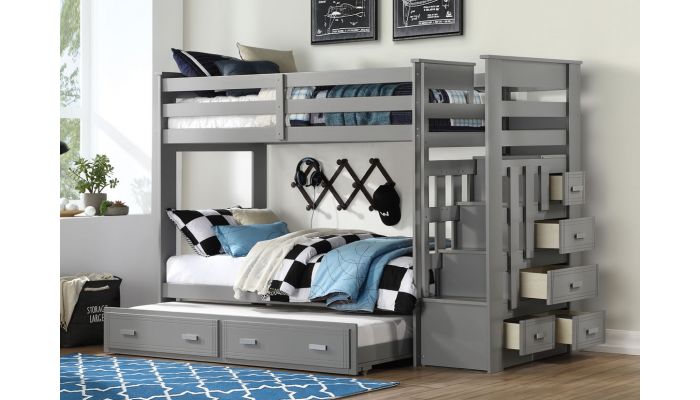
This screenshot has height=400, width=700. In order to click on pillow in this screenshot , I will do `click(244, 241)`.